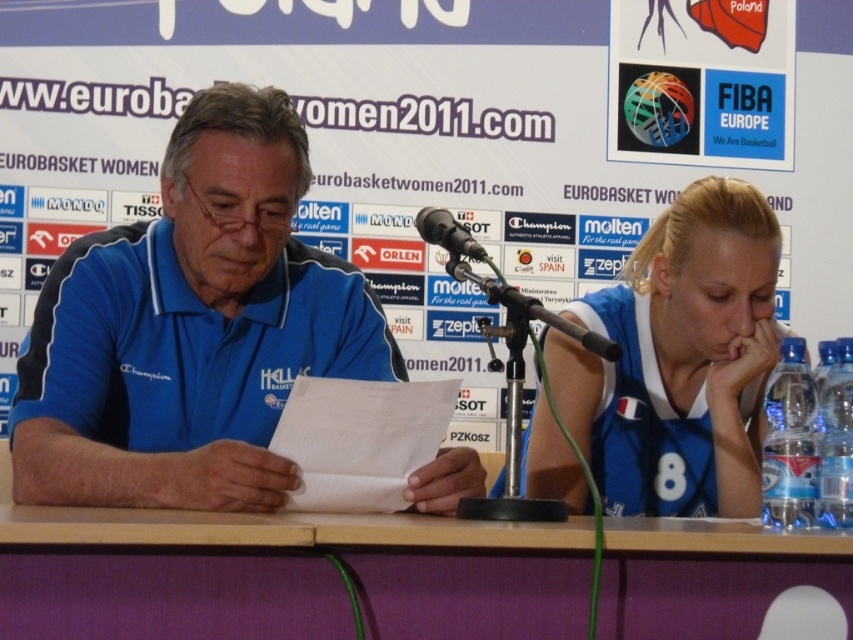
Between point (77, 452) and point (851, 618), which one is positioned in front?

Point (851, 618) is more forward.

Which is more to the right, blue jersey at center or wooden table at center?

wooden table at center is more to the right.

Is point (202, 508) positioned after point (602, 611)?

Yes, it is behind point (602, 611).

You are a GUI agent. You are given a task and a screenshot of the screen. Output one action in this format:
    pyautogui.click(x=<x>, y=<y>)
    Task: Click on the blue jersey at center
    The height and width of the screenshot is (640, 853).
    Given the screenshot: What is the action you would take?
    pyautogui.click(x=190, y=328)

Between wooden table at center and blue jersey at right, which one is positioned higher?

Positioned higher is blue jersey at right.

Does wooden table at center appear on the left side of blue jersey at right?

Correct, you'll find wooden table at center to the left of blue jersey at right.

The image size is (853, 640). What are the coordinates of `wooden table at center` in the screenshot? It's located at (360, 561).

Where is `wooden table at center`? This screenshot has width=853, height=640. wooden table at center is located at coordinates (360, 561).

Which of these two, wooden table at center or black plastic microphone at center, stands shorter?

With less height is black plastic microphone at center.

What do you see at coordinates (360, 561) in the screenshot? I see `wooden table at center` at bounding box center [360, 561].

The width and height of the screenshot is (853, 640). Identify the location of wooden table at center. (360, 561).